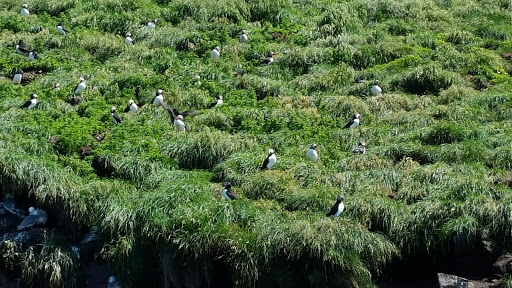
At what (x,y) coordinates should I click in order to perform the action: click on white chest. Please return your answer as a coordinate pair (x, y). Looking at the image, I should click on (34, 104).